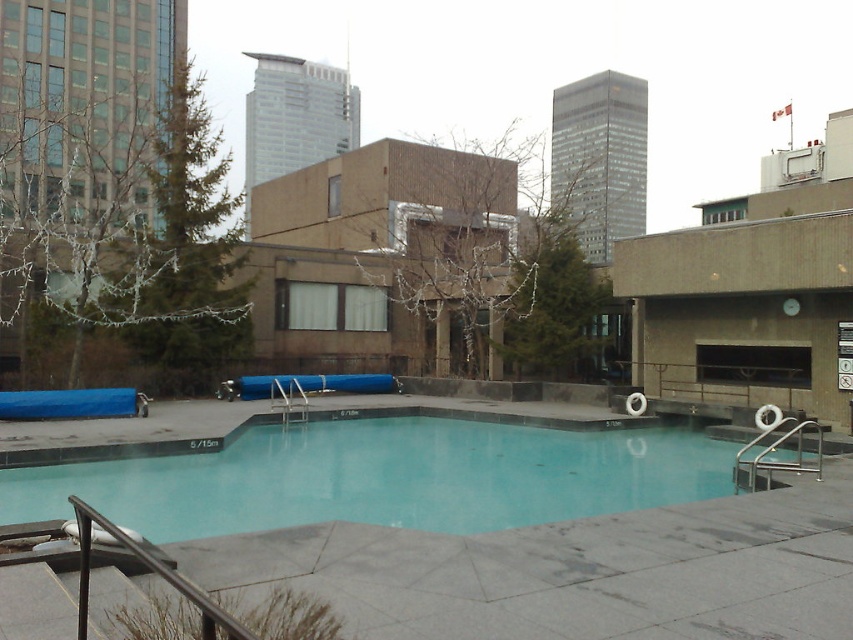
How far apart are clear glass pool at center and stainless steel handrail at right?

clear glass pool at center and stainless steel handrail at right are 21.28 feet apart.

Is clear glass pool at center further to camera compared to stainless steel handrail at right?

No.

Which is behind, point (543, 518) or point (780, 419)?

Positioned behind is point (780, 419).

Where is `clear glass pool at center`? Image resolution: width=853 pixels, height=640 pixels. clear glass pool at center is located at coordinates (381, 477).

Looking at this image, is black metal/rail at lower left wider than stainless steel handrail at right?

Yes, black metal/rail at lower left is wider than stainless steel handrail at right.

Between black metal/rail at lower left and stainless steel handrail at right, which one is positioned higher?

black metal/rail at lower left is higher up.

Does point (218, 627) come behind point (809, 419)?

No, it is not.

Find the location of a particular element. black metal/rail at lower left is located at coordinates (149, 570).

Does clear glass pool at center appear on the left side of black metal/rail at lower left?

Incorrect, clear glass pool at center is not on the left side of black metal/rail at lower left.

Can you confirm if clear glass pool at center is positioned to the right of black metal/rail at lower left?

Indeed, clear glass pool at center is positioned on the right side of black metal/rail at lower left.

Does point (488, 496) come closer to viewer compared to point (119, 532)?

No, it is behind (119, 532).

Image resolution: width=853 pixels, height=640 pixels. In order to click on clear glass pool at center in this screenshot , I will do `click(381, 477)`.